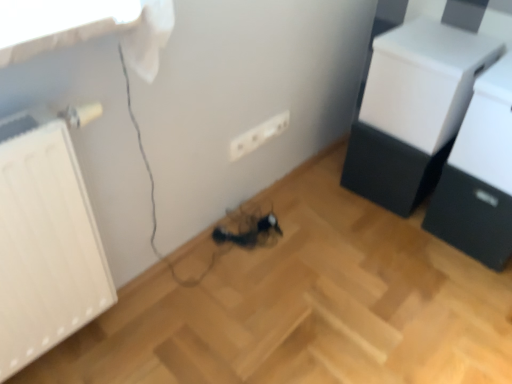
Question: Is white matte radiator at left positioned beyond the bounds of black matte drawer at lower right?

Choices:
 (A) no
 (B) yes

Answer: (B)

Question: Is white matte radiator at left positioned in front of black matte drawer at lower right?

Choices:
 (A) yes
 (B) no

Answer: (A)

Question: Can black matte drawer at lower right be found inside white matte radiator at left?

Choices:
 (A) yes
 (B) no

Answer: (B)

Question: From the image's perspective, is white matte radiator at left over black matte drawer at lower right?

Choices:
 (A) yes
 (B) no

Answer: (B)

Question: From the image's perspective, is white matte radiator at left located beneath black matte drawer at lower right?

Choices:
 (A) no
 (B) yes

Answer: (B)

Question: Which is correct: black matte drawer at lower right is inside white matte drawer at upper right, the second furniture from the right, or outside of it?

Choices:
 (A) outside
 (B) inside

Answer: (A)

Question: Considering the positions of black matte drawer at lower right and white matte drawer at upper right, the second furniture from the right, in the image, is black matte drawer at lower right bigger or smaller than white matte drawer at upper right, the second furniture from the right,?

Choices:
 (A) big
 (B) small

Answer: (A)

Question: Considering the positions of point (493, 205) and point (488, 46), is point (493, 205) closer or farther from the camera than point (488, 46)?

Choices:
 (A) closer
 (B) farther

Answer: (A)

Question: In terms of height, does black matte drawer at lower right look taller or shorter compared to white matte drawer at upper right, arranged as the first furniture when viewed from the left?

Choices:
 (A) short
 (B) tall

Answer: (A)

Question: Which is correct: white glossy printer at upper right, placed as the 2th furniture when sorted from left to right, is inside white plastic electric outlet at center, or outside of it?

Choices:
 (A) inside
 (B) outside

Answer: (B)

Question: Looking at the image, does white glossy printer at upper right, placed as the 2th furniture when sorted from left to right, seem bigger or smaller compared to white plastic electric outlet at center?

Choices:
 (A) big
 (B) small

Answer: (A)

Question: From a real-world perspective, is white glossy printer at upper right, which appears as the 1th furniture when viewed from the right, above or below white plastic electric outlet at center?

Choices:
 (A) below
 (B) above

Answer: (B)

Question: Is white glossy printer at upper right, which appears as the 1th furniture when viewed from the right, in front of or behind white plastic electric outlet at center in the image?

Choices:
 (A) front
 (B) behind

Answer: (A)

Question: Relative to white glossy printer at upper right, which appears as the 1th furniture when viewed from the right, is black matte drawer at lower right in front or behind?

Choices:
 (A) front
 (B) behind

Answer: (B)

Question: Considering the positions of point (474, 248) and point (501, 223), is point (474, 248) closer or farther from the camera than point (501, 223)?

Choices:
 (A) closer
 (B) farther

Answer: (B)